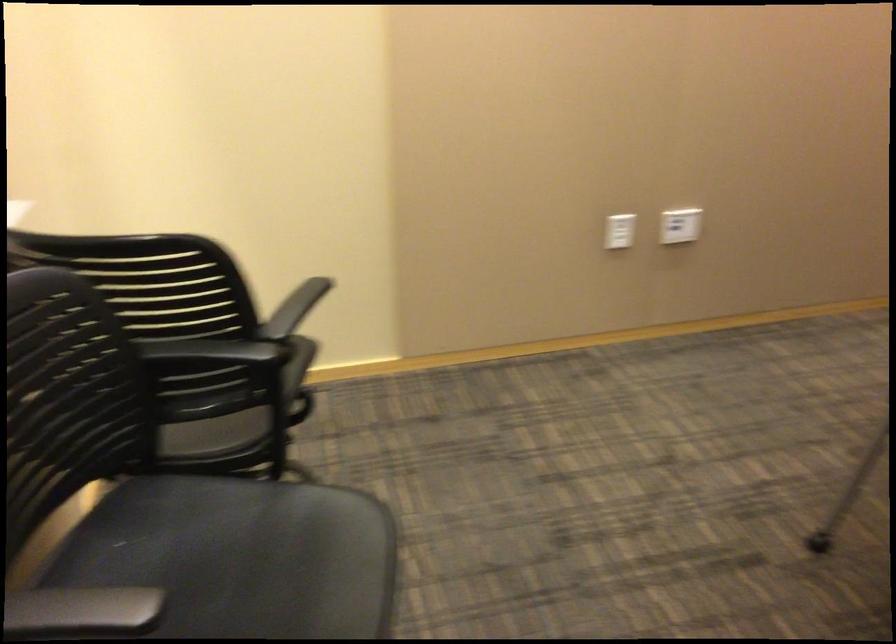
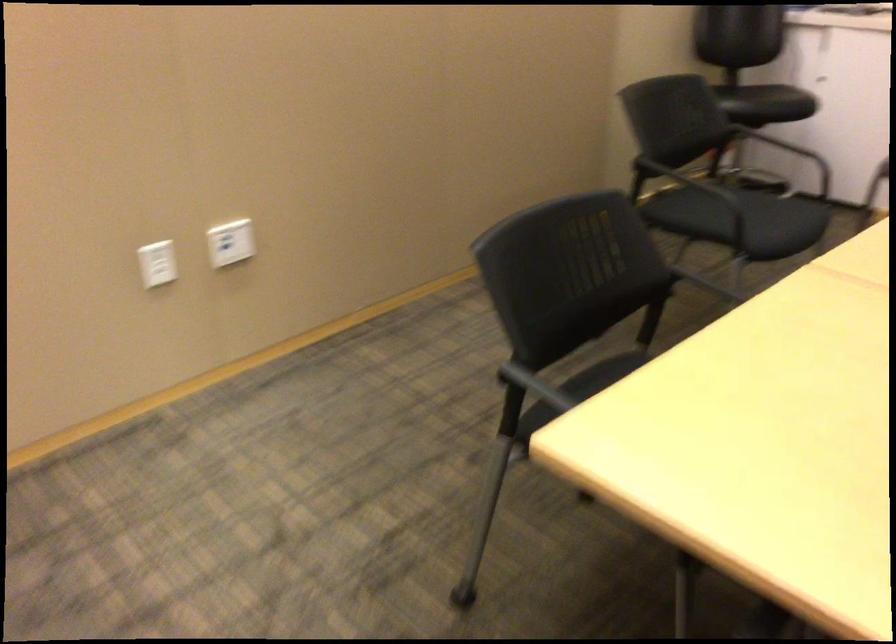
Question: The first image is from the beginning of the video and the second image is from the end. How did the camera likely rotate when shooting the video?

Choices:
 (A) Left
 (B) Right
 (C) Up
 (D) Down

Answer: (B)